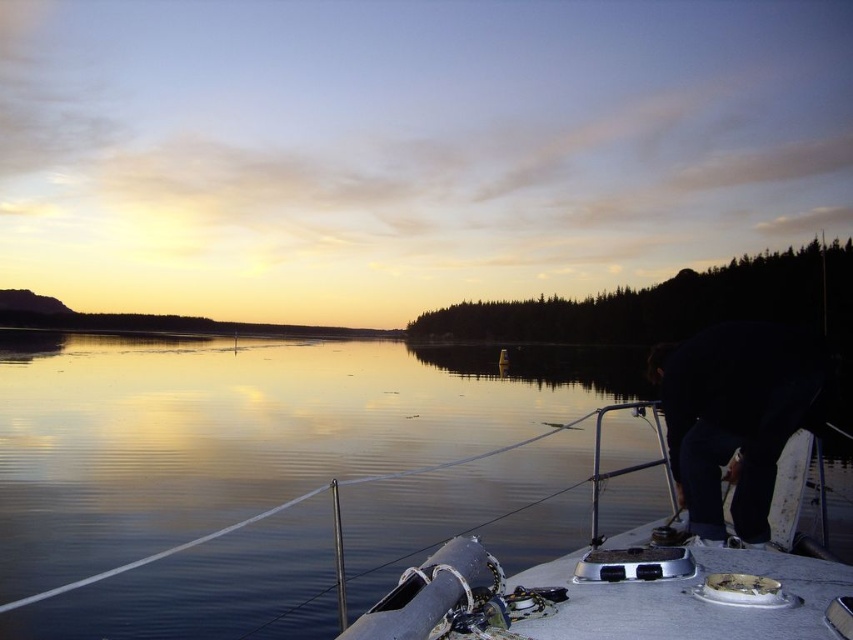
Question: Estimate the real-world distances between objects in this image. Which object is closer to the metallic gray boat at lower right?

Choices:
 (A) glossy reflective water at center
 (B) dark blue jeans at lower right

Answer: (B)

Question: Where is glossy reflective water at center located in relation to dark blue jeans at lower right in the image?

Choices:
 (A) left
 (B) right

Answer: (A)

Question: Which point appears closest to the camera in this image?

Choices:
 (A) (672, 355)
 (B) (270, 560)

Answer: (A)

Question: Does glossy reflective water at center appear under metallic gray boat at lower right?

Choices:
 (A) no
 (B) yes

Answer: (B)

Question: In this image, where is metallic gray boat at lower right located relative to dark blue jeans at lower right?

Choices:
 (A) left
 (B) right

Answer: (A)

Question: Estimate the real-world distances between objects in this image. Which object is farther from the metallic gray boat at lower right?

Choices:
 (A) glossy reflective water at center
 (B) dark blue jeans at lower right

Answer: (A)